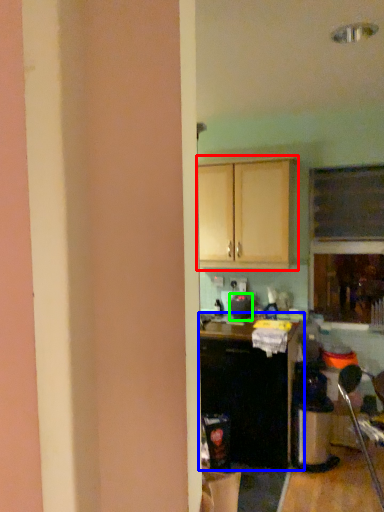
Question: Based on their relative distances, which object is farther from cabinetry (highlighted by a red box)? Choose from cabinetry (highlighted by a blue box) and appliance (highlighted by a green box).

Choices:
 (A) cabinetry
 (B) appliance

Answer: (A)